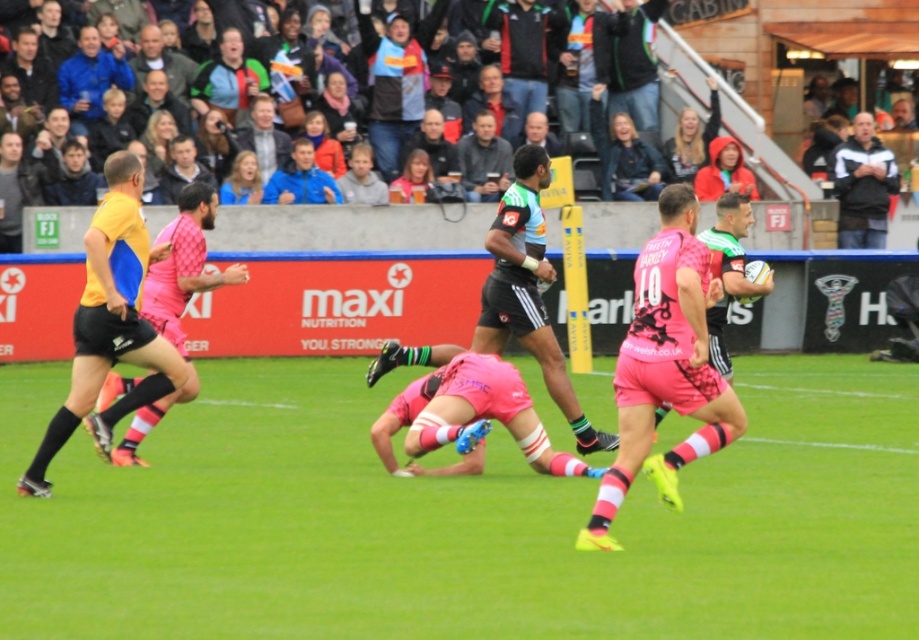
Question: Does black matte shorts at center appear on the right side of dark gray jacket at upper center?

Choices:
 (A) no
 (B) yes

Answer: (A)

Question: Which point is farther to the camera?

Choices:
 (A) dark gray jacket at upper center
 (B) black matte shorts at center
 (C) yellow matte shorts at left
 (D) green grass football field at center

Answer: (A)

Question: Considering the real-world distances, which object is farthest from the black and white jacket at upper right?

Choices:
 (A) green grass football field at center
 (B) matte yellow shorts at left
 (C) pink matte jersey at center

Answer: (C)

Question: Does yellow matte shorts at left appear under black and white jacket at upper right?

Choices:
 (A) yes
 (B) no

Answer: (A)

Question: Considering the real-world distances, which object is farthest from the pink matte jersey at center?

Choices:
 (A) dark gray jacket at upper center
 (B) green grass football field at center
 (C) black and white jacket at upper right
 (D) black matte shorts at center

Answer: (C)

Question: Does pink matte jersey at center have a smaller size compared to black and white jacket at upper right?

Choices:
 (A) no
 (B) yes

Answer: (A)